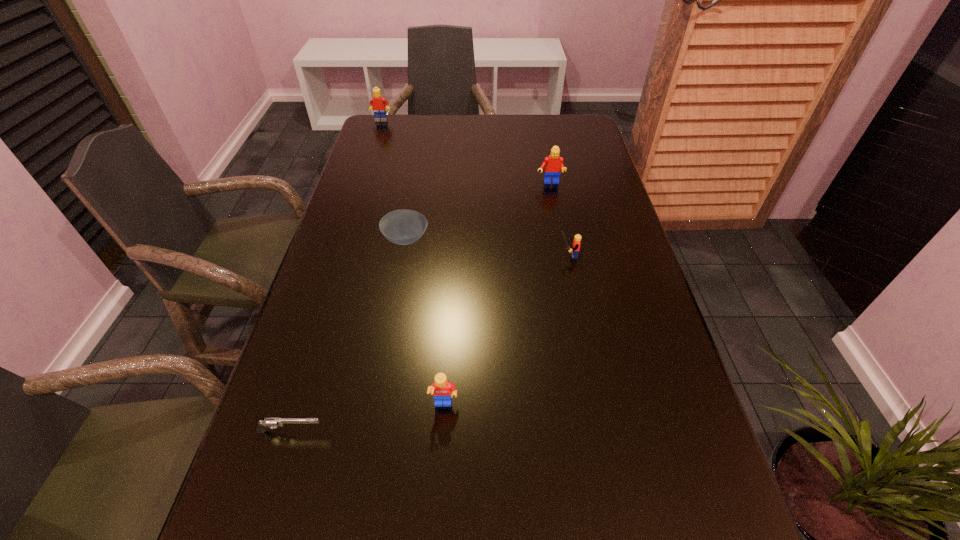
Image resolution: width=960 pixels, height=540 pixels. In order to click on vacant area situated on the front-facing side of the second nearest Lego in this screenshot , I will do `click(433, 256)`.

Image resolution: width=960 pixels, height=540 pixels. What are the coordinates of `vacant position located 0.350m on the front-facing side of the second nearest Lego` in the screenshot? It's located at (418, 256).

This screenshot has height=540, width=960. What are the coordinates of `free space located on the front-facing side of the second nearest Lego` in the screenshot? It's located at (533, 256).

This screenshot has width=960, height=540. I want to click on vacant space located on the face of the nearest Lego, so click(441, 453).

In order to click on blank area located 0.150m on the right of the third object from left to right in this screenshot , I will do `click(487, 239)`.

Image resolution: width=960 pixels, height=540 pixels. What are the coordinates of `free space located 0.350m on the front-facing side of the nearest object` in the screenshot? It's located at (519, 431).

The height and width of the screenshot is (540, 960). In order to click on object that is at the far edge in this screenshot , I will do `click(377, 103)`.

Where is `Lego situated at the left edge`? The width and height of the screenshot is (960, 540). Lego situated at the left edge is located at coordinates (377, 103).

The height and width of the screenshot is (540, 960). I want to click on bowl that is at the left edge, so click(x=403, y=227).

Locate an element on the screen. The height and width of the screenshot is (540, 960). pistol at the left edge is located at coordinates (266, 423).